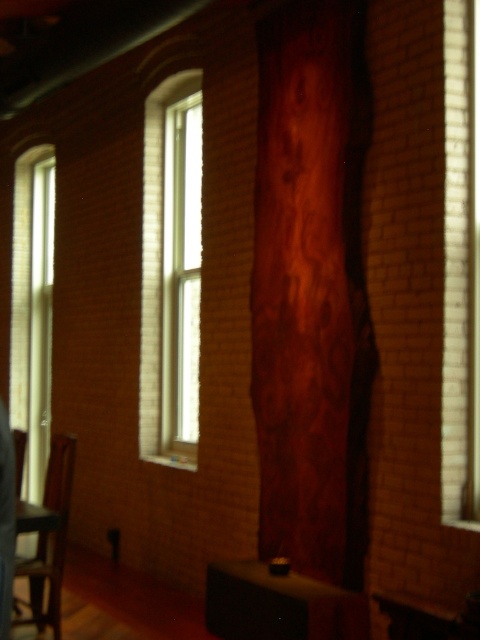
Is burl wood curtain at center further to the viewer compared to clear glass window at right?

That is True.

Is point (284, 240) positioned after point (454, 488)?

That is True.

This screenshot has width=480, height=640. I want to click on burl wood curtain at center, so click(x=312, y=289).

Can you confirm if clear glass window at right is shorter than clear glass window at left?

Indeed, clear glass window at right has a lesser height compared to clear glass window at left.

From the picture: Measure the distance between clear glass window at right and camera.

clear glass window at right and camera are 3.79 meters apart.

What are the coordinates of `clear glass window at right` in the screenshot? It's located at (460, 266).

Does clear glass window at left come behind shiny black phone at left?

Yes.

Between clear glass window at left and shiny black phone at left, which one is positioned higher?

clear glass window at left is above.

Locate an element on the screen. This screenshot has width=480, height=640. clear glass window at left is located at coordinates (33, 310).